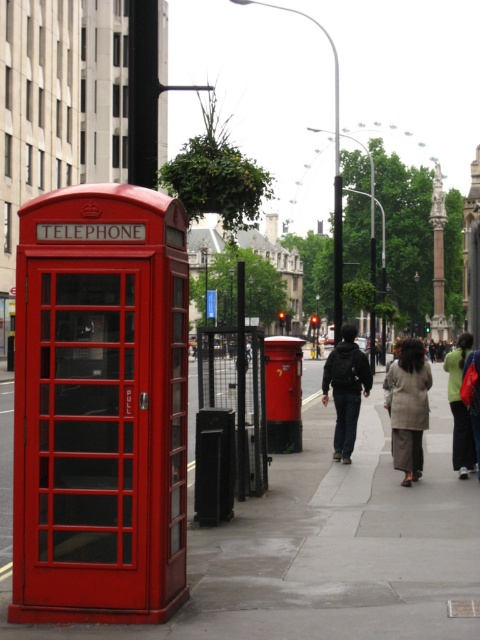
Between matte red telephone at left and dark gray fabric coat at center, which one has more height?

matte red telephone at left

Between matte red telephone at left and dark gray fabric coat at center, which one has less height?

dark gray fabric coat at center is shorter.

Is point (36, 268) positioned behind point (457, 448)?

No, (36, 268) is closer to viewer.

Where is `matte red telephone at left`? The image size is (480, 640). matte red telephone at left is located at coordinates (99, 406).

Does smooth concrete sidewalk at center have a greater height compared to dark gray fabric coat at center?

In fact, smooth concrete sidewalk at center may be shorter than dark gray fabric coat at center.

The height and width of the screenshot is (640, 480). In order to click on smooth concrete sidewalk at center in this screenshot , I will do `click(330, 545)`.

Does point (393, 480) come closer to viewer compared to point (335, 433)?

Yes.

Who is higher up, smooth concrete sidewalk at center or dark gray fabric jacket at center?

dark gray fabric jacket at center

The height and width of the screenshot is (640, 480). What do you see at coordinates (330, 545) in the screenshot?
I see `smooth concrete sidewalk at center` at bounding box center [330, 545].

At what (x,y) coordinates should I click in order to perform the action: click on smooth concrete sidewalk at center. Please return your answer as a coordinate pair (x, y). Looking at the image, I should click on (330, 545).